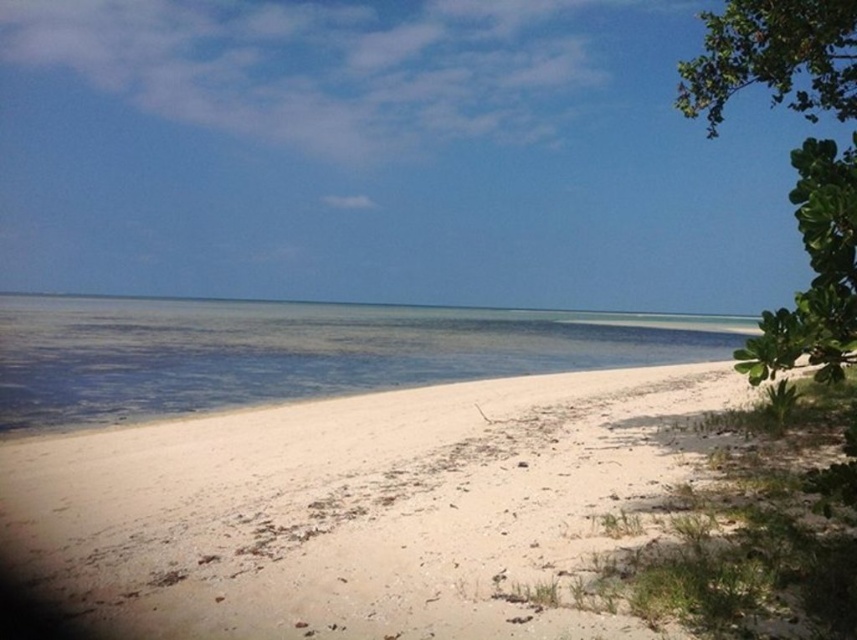
Question: Is clear water at center to the right of green leafy tree at upper right from the viewer's perspective?

Choices:
 (A) yes
 (B) no

Answer: (B)

Question: Which of the following is the farthest from the observer?

Choices:
 (A) [583, 353]
 (B) [691, 67]

Answer: (A)

Question: Estimate the real-world distances between objects in this image. Which object is closer to the green leafy tree at upper right?

Choices:
 (A) clear water at center
 (B) white sandy beach at lower right

Answer: (B)

Question: Which object is closer to the camera taking this photo?

Choices:
 (A) clear water at center
 (B) green leafy tree at upper right

Answer: (B)

Question: Can you confirm if white sandy beach at lower right is positioned above clear water at center?

Choices:
 (A) yes
 (B) no

Answer: (B)

Question: Observing the image, what is the correct spatial positioning of clear water at center in reference to green leafy tree at upper right?

Choices:
 (A) below
 (B) above

Answer: (A)